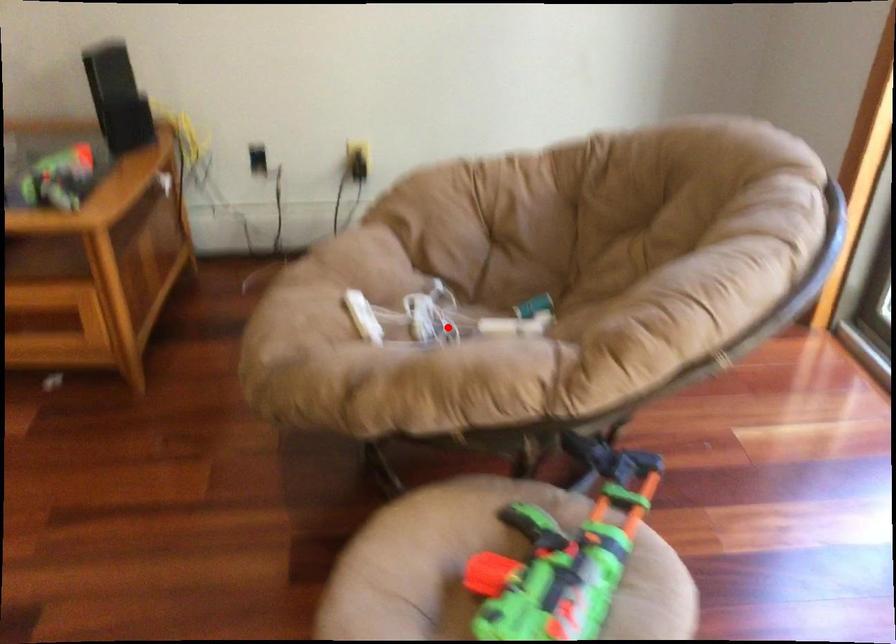
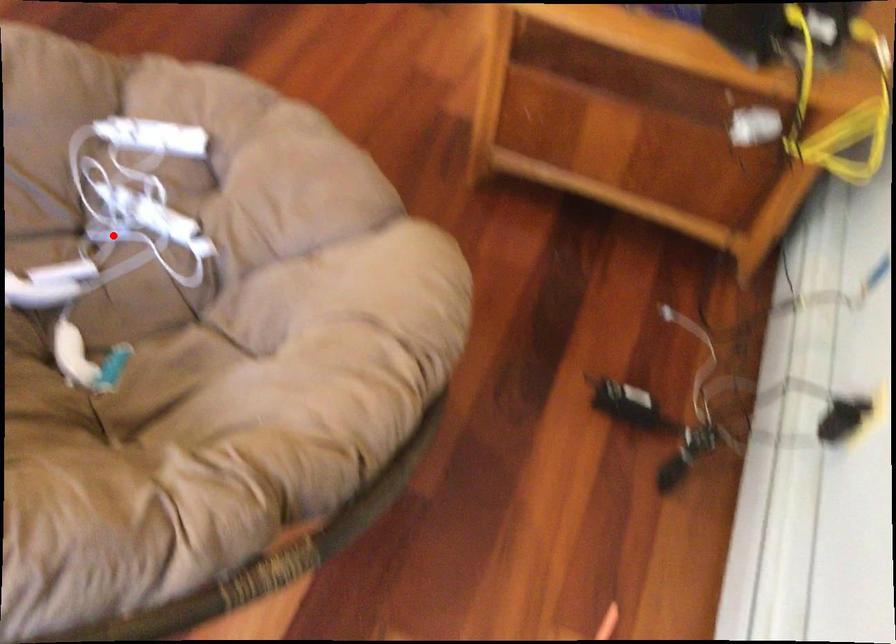
I am providing you with two images of the same scene from different viewpoints. A red point is marked on the first image and another point is marked on the second image. Is the marked point in image1 the same physical position as the marked point in image2?

Yes